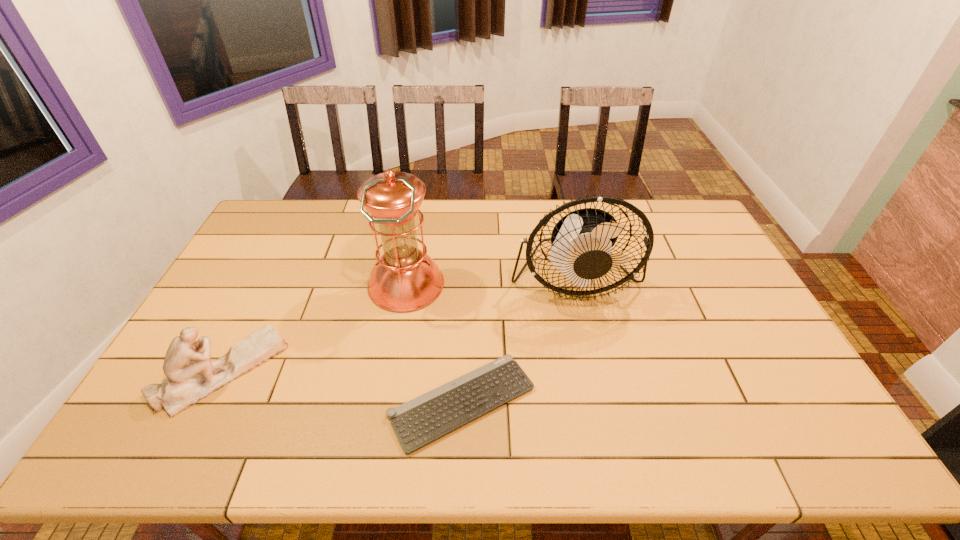
This screenshot has width=960, height=540. What are the coordinates of `vacant area that lies between the leftmost object and the shortest object` in the screenshot? It's located at (343, 386).

The height and width of the screenshot is (540, 960). I want to click on free space between the computer keyboard and the figurine, so click(343, 386).

Where is `empty space that is in between the shortest object and the figurine`? This screenshot has height=540, width=960. empty space that is in between the shortest object and the figurine is located at coordinates (343, 386).

Locate an element on the screen. free spot between the fan and the third tallest object is located at coordinates (398, 325).

I want to click on free space between the fan and the leftmost object, so click(x=398, y=325).

Select which object is the third closest to the second shortest object. Please provide its 2D coordinates. Your answer should be formatted as a tuple, i.e. [(x, y)], where the tuple contains the x and y coordinates of a point satisfying the conditions above.

[(582, 241)]

Image resolution: width=960 pixels, height=540 pixels. What are the coordinates of `object that ranks as the second closest to the leftmost object` in the screenshot? It's located at (418, 422).

The width and height of the screenshot is (960, 540). What are the coordinates of `free space that satisfies the following two spatial constraints: 1. on the front-facing side of the computer keyboard; 2. on the left side of the leftmost object` in the screenshot? It's located at (x=207, y=402).

Where is `vacant area in the image that satisfies the following two spatial constraints: 1. in front of the fan, directing airflow; 2. on the front-facing side of the figurine`? This screenshot has width=960, height=540. vacant area in the image that satisfies the following two spatial constraints: 1. in front of the fan, directing airflow; 2. on the front-facing side of the figurine is located at coordinates (595, 371).

Where is `blank area in the image that satisfies the following two spatial constraints: 1. on the back side of the shortest object; 2. on the front-facing side of the figurine`? blank area in the image that satisfies the following two spatial constraints: 1. on the back side of the shortest object; 2. on the front-facing side of the figurine is located at coordinates (464, 371).